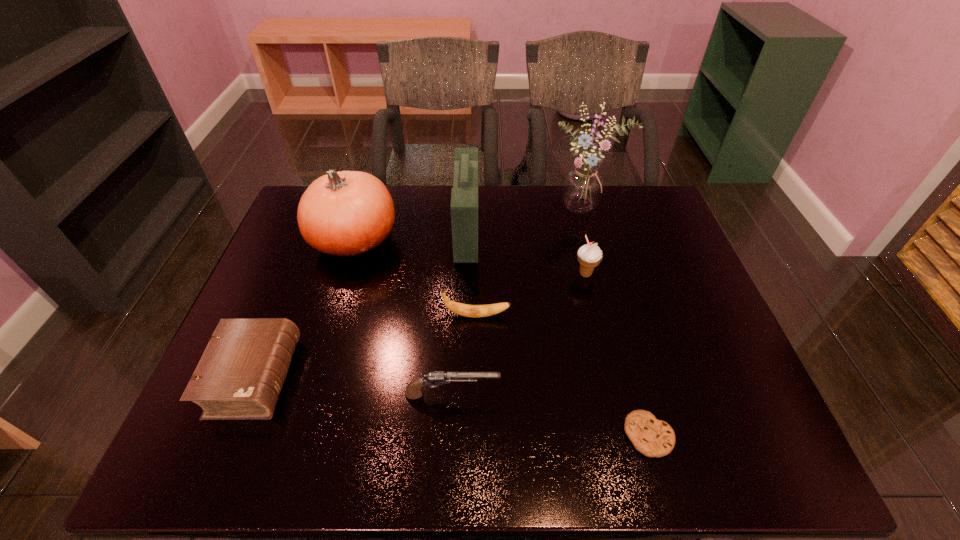
At what (x,y) coordinates should I click in order to perform the action: click on vacant region that satisfies the following two spatial constraints: 1. on the front-facing side of the cookie; 2. on the right side of the bouquet. Please return your answer as a coordinate pair (x, y). The width and height of the screenshot is (960, 540). Looking at the image, I should click on (646, 435).

The image size is (960, 540). I want to click on free space that satisfies the following two spatial constraints: 1. on the front-facing side of the first-aid kit; 2. on the back side of the icecream, so (x=466, y=274).

I want to click on free space that satisfies the following two spatial constraints: 1. on the front-facing side of the first-aid kit; 2. on the front side of the pumpkin, so point(467,240).

Locate an element on the screen. This screenshot has height=540, width=960. free location that satisfies the following two spatial constraints: 1. on the front-facing side of the first-aid kit; 2. on the back side of the shortest object is located at coordinates (461, 435).